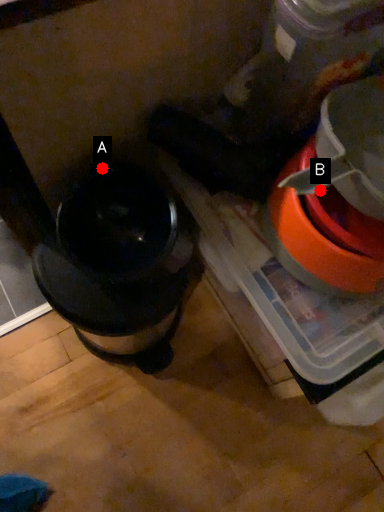
Question: Two points are circled on the image, labeled by A and B beside each circle. Which point is closer to the camera?

Choices:
 (A) A is closer
 (B) B is closer

Answer: (B)